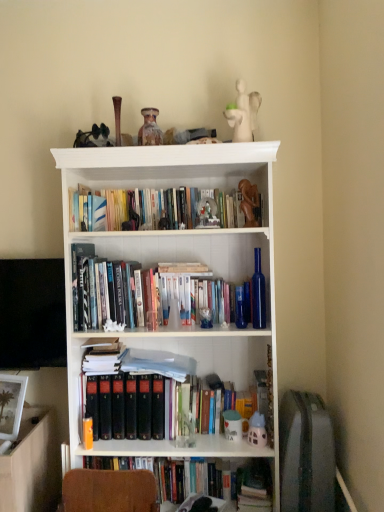
Question: Relative to translucent plastic toy at lower center, marked as the 1th toy in a right-to-left arrangement, is matte white toy at center, arranged as the first toy when ordered from the bottom, in front or behind?

Choices:
 (A) front
 (B) behind

Answer: (B)

Question: Is point (228, 435) closer or farther from the camera than point (254, 415)?

Choices:
 (A) farther
 (B) closer

Answer: (A)

Question: Which object is the farthest from the wooden statue at upper center, marked as the third toy in a top-to-bottom arrangement?

Choices:
 (A) hardcover books at upper center
 (B) white wood bookcase at center
 (C) matte white toy at center, the 2th toy from the left
 (D) white matte figurine at upper center, positioned as the 5th toy in bottom-to-top order
 (E) speckled ceramic vase at upper center, arranged as the 2th toy when viewed from the top

Answer: (C)

Question: Which of these objects is positioned closest to the hardcover books at upper center?

Choices:
 (A) wooden statue at upper center, marked as the third toy in a top-to-bottom arrangement
 (B) white matte figurine at upper center, which is the third toy in right-to-left order
 (C) white wood bookcase at center
 (D) speckled ceramic vase at upper center, positioned as the fifth toy in right-to-left order
 (E) translucent plastic toy at lower center, the second toy positioned from the bottom

Answer: (C)